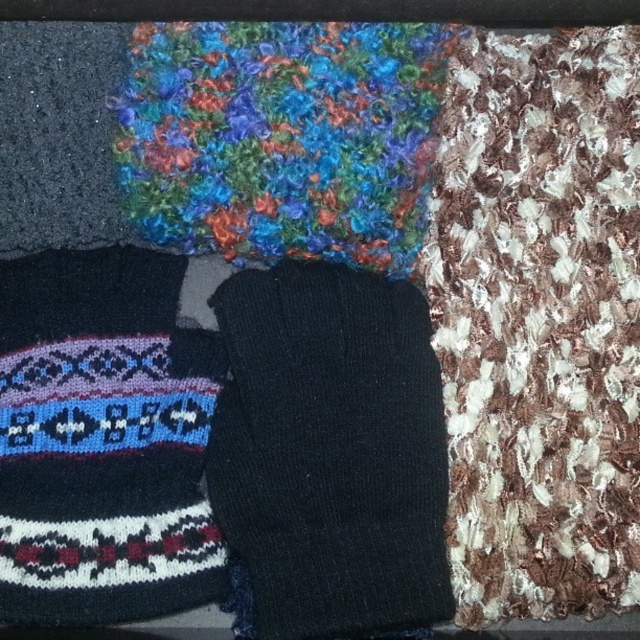
Question: Which point is closer to the camera taking this photo?

Choices:
 (A) coord(259,352)
 (B) coord(10,388)

Answer: (B)

Question: Does black knitted sock at center have a greater width compared to knitted woolen sock at lower left?

Choices:
 (A) yes
 (B) no

Answer: (A)

Question: In this image, where is black knitted sock at center located relative to knitted woolen sock at lower left?

Choices:
 (A) below
 (B) above

Answer: (A)

Question: Does black knitted sock at center appear over knitted woolen sock at lower left?

Choices:
 (A) yes
 (B) no

Answer: (B)